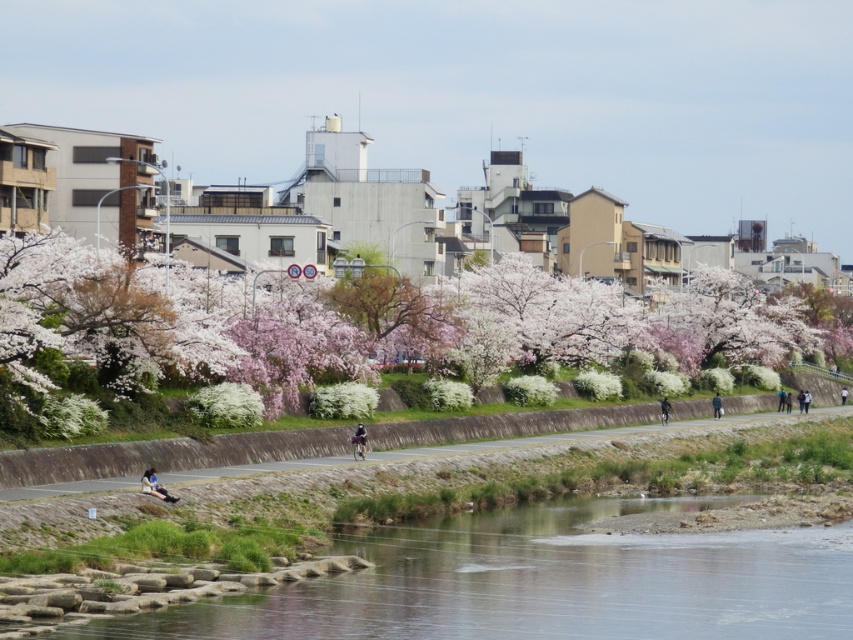
You are standing at the riverside and want to walk to a specific location marked by point (144,472). Given that the path is 58.61 meters away from where you are standing, can you estimate how long it would take you to reach there if you walk at a normal pace of 1.4 meters per second?

The distance between your current position and point (144,472) is 58.61 meters. At a walking speed of 1.4 meters per second, it would take approximately 41.86 seconds to reach the point. This means it would take roughly 42 seconds to get there.